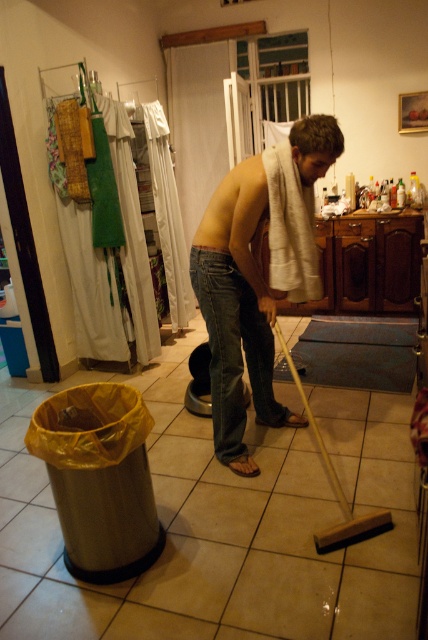
Between shiny white towel at center and denim jeans at center, which one has more height?

With more height is shiny white towel at center.

Between point (300, 195) and point (241, 333), which one is positioned behind?

The point (241, 333) is more distant.

This screenshot has width=428, height=640. Identify the location of shiny white towel at center. (237, 308).